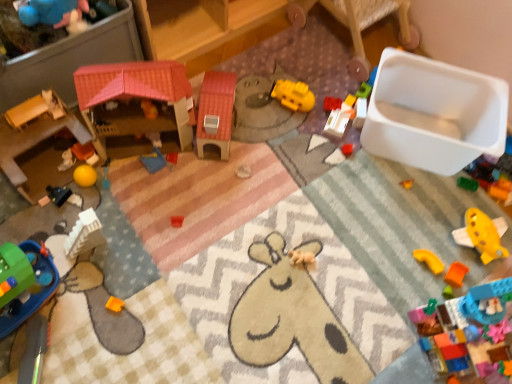
This screenshot has height=384, width=512. I want to click on empty space that is in between yellow plastic airplane at lower right, arranged as the 15th toy when viewed from the left, and white plastic container at center, marked as the 6th toy in a right-to-left arrangement, so click(407, 190).